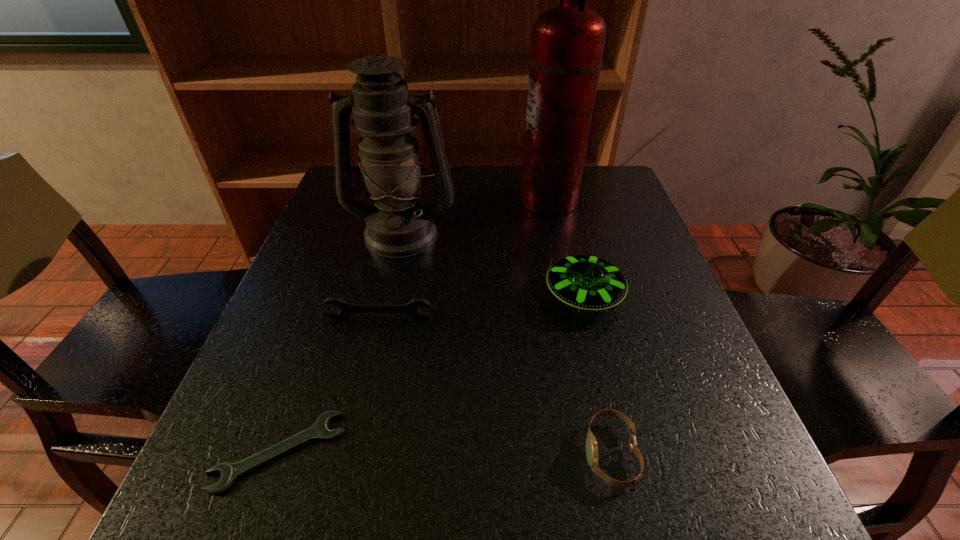
In the image, there is a desktop. Identify the location of vacant space at the far right corner. (606, 187).

Locate an element on the screen. This screenshot has height=540, width=960. vacant space at the near right corner of the desktop is located at coordinates (690, 516).

The width and height of the screenshot is (960, 540). Identify the location of unoccupied area between the taller wrench and the fire extinguisher. (464, 259).

You are a GUI agent. You are given a task and a screenshot of the screen. Output one action in this format:
    pyautogui.click(x=<x>, y=<y>)
    Task: Click on the vacant area between the watch and the shorter wrench
    This screenshot has height=540, width=960.
    Given the screenshot: What is the action you would take?
    pyautogui.click(x=445, y=453)

Locate an element on the screen. Image resolution: width=960 pixels, height=540 pixels. free space between the oil lamp and the watch is located at coordinates (506, 343).

Locate an element on the screen. The height and width of the screenshot is (540, 960). free space between the farther wrench and the saucer is located at coordinates (481, 307).

Locate an element on the screen. This screenshot has width=960, height=540. free space between the fourth shortest object and the watch is located at coordinates (597, 375).

Locate an element on the screen. The height and width of the screenshot is (540, 960). vacant space that's between the oil lamp and the taller wrench is located at coordinates (391, 275).

Identify the location of vacant region between the nearer wrench and the third tallest object. (431, 374).

Locate an element on the screen. Image resolution: width=960 pixels, height=540 pixels. free space between the saucer and the oil lamp is located at coordinates (492, 264).